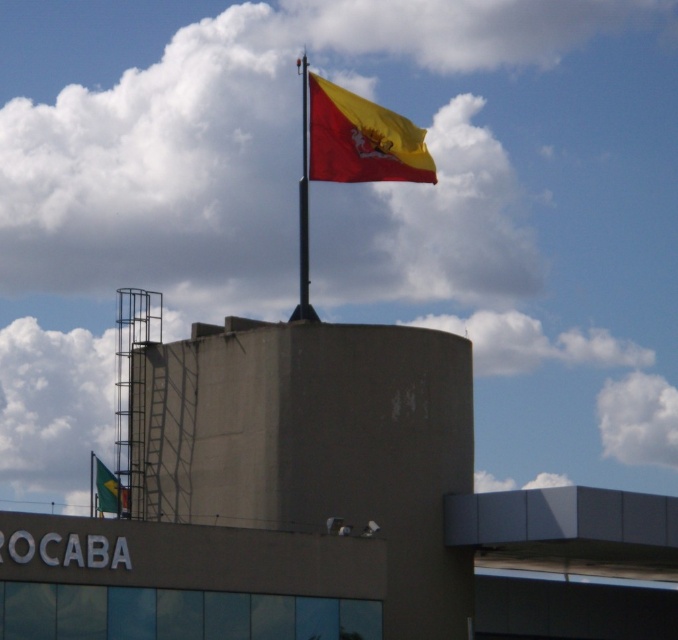
Can you confirm if yellow matte flag at upper center is taller than green fabric flag at lower left?

Incorrect, yellow matte flag at upper center's height is not larger of green fabric flag at lower left's.

Can you confirm if yellow matte flag at upper center is wider than green fabric flag at lower left?

Incorrect, yellow matte flag at upper center's width does not surpass green fabric flag at lower left's.

Image resolution: width=678 pixels, height=640 pixels. Identify the location of yellow matte flag at upper center. (361, 140).

Find the location of `yellow matte flag at upper center`. yellow matte flag at upper center is located at coordinates (361, 140).

In the scene shown: Can you confirm if polished metal flag pole at upper center is thinner than green fabric flag at lower left?

Yes.

Can you confirm if polished metal flag pole at upper center is smaller than green fabric flag at lower left?

Indeed, polished metal flag pole at upper center has a smaller size compared to green fabric flag at lower left.

Describe the element at coordinates (302, 208) in the screenshot. This screenshot has width=678, height=640. I see `polished metal flag pole at upper center` at that location.

Image resolution: width=678 pixels, height=640 pixels. Find the location of `polished metal flag pole at upper center`. polished metal flag pole at upper center is located at coordinates (302, 208).

Between polished metal flag pole at upper center and metallic flag pole at upper center, which one is positioned lower?

metallic flag pole at upper center is lower down.

Does polished metal flag pole at upper center have a greater height compared to metallic flag pole at upper center?

No, polished metal flag pole at upper center is not taller than metallic flag pole at upper center.

Which is behind, point (311, 310) or point (306, 212)?

Positioned behind is point (306, 212).

Where is `polished metal flag pole at upper center`? Image resolution: width=678 pixels, height=640 pixels. polished metal flag pole at upper center is located at coordinates (302, 208).